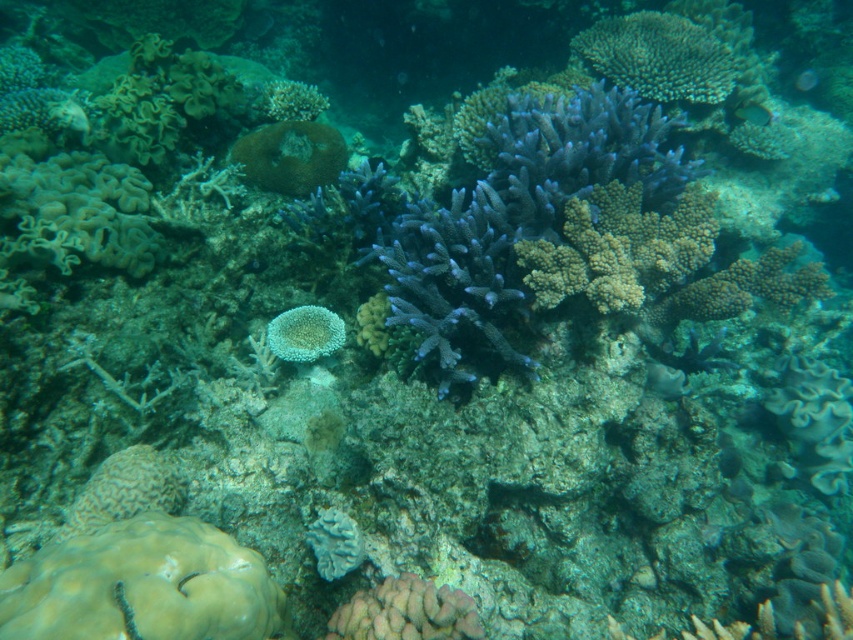
You are a marine biologist observing the underwater scene. You notice the rough textured coral at upper right and the translucent blue fish at upper right. Based on their positions, which one is closer to the surface of the water?

The translucent blue fish at upper right is closer to the surface of the water because it is above the rough textured coral at upper right.

You are a marine biologist observing this underwater scene. You notice two points marked in the image. Which point is closer to you, point at (305, 346) or point at (332, 547)?

Point at (305, 346) is closer to you because it is further to the viewer than point at (332, 547).

You are a marine biologist studying the coral reef. You notice a rough textured coral at upper right and a translucent blue fish at upper right. How far apart are these two marine organisms?

The distance between the rough textured coral at upper right and the translucent blue fish at upper right is 2.13 meters.